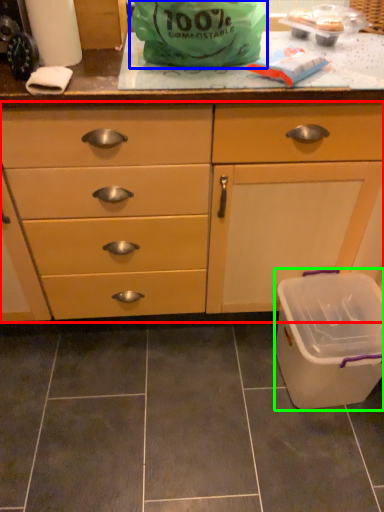
Question: Based on their relative distances, which object is nearer to cabinetry (highlighted by a red box)? Choose from plastic bag (highlighted by a blue box) and recycling bin (highlighted by a green box).

Choices:
 (A) plastic bag
 (B) recycling bin

Answer: (B)